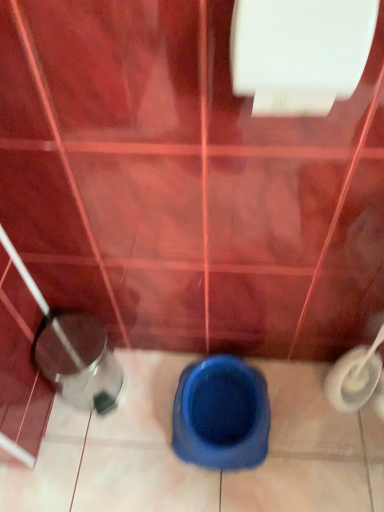
Question: Should I look upward or downward to see blue rubber toilet at center?

Choices:
 (A) up
 (B) down

Answer: (B)

Question: From the image's perspective, is blue rubber toilet at center below shiny metallic potty at lower left?

Choices:
 (A) no
 (B) yes

Answer: (B)

Question: Can you confirm if blue rubber toilet at center is smaller than shiny metallic potty at lower left?

Choices:
 (A) no
 (B) yes

Answer: (B)

Question: Is blue rubber toilet at center further to the viewer compared to shiny metallic potty at lower left?

Choices:
 (A) yes
 (B) no

Answer: (B)

Question: From the image's perspective, is blue rubber toilet at center over shiny metallic potty at lower left?

Choices:
 (A) no
 (B) yes

Answer: (A)

Question: Considering the relative sizes of blue rubber toilet at center and shiny metallic potty at lower left in the image provided, is blue rubber toilet at center bigger than shiny metallic potty at lower left?

Choices:
 (A) no
 (B) yes

Answer: (A)

Question: Can you confirm if blue rubber toilet at center is positioned to the right of shiny metallic potty at lower left?

Choices:
 (A) no
 (B) yes

Answer: (B)

Question: Is white glossy toilet paper at upper center smaller than shiny metallic potty at lower left?

Choices:
 (A) yes
 (B) no

Answer: (A)

Question: Is white glossy toilet paper at upper center taller than shiny metallic potty at lower left?

Choices:
 (A) no
 (B) yes

Answer: (A)

Question: Considering the relative sizes of white glossy toilet paper at upper center and shiny metallic potty at lower left in the image provided, is white glossy toilet paper at upper center bigger than shiny metallic potty at lower left?

Choices:
 (A) no
 (B) yes

Answer: (A)

Question: Is white glossy toilet paper at upper center outside shiny metallic potty at lower left?

Choices:
 (A) yes
 (B) no

Answer: (A)

Question: Is white glossy toilet paper at upper center not close to shiny metallic potty at lower left?

Choices:
 (A) no
 (B) yes

Answer: (A)

Question: Can you confirm if white glossy toilet paper at upper center is thinner than shiny metallic potty at lower left?

Choices:
 (A) no
 (B) yes

Answer: (B)

Question: From a real-world perspective, is white glossy toilet paper at upper center below blue rubber toilet at center?

Choices:
 (A) yes
 (B) no

Answer: (B)